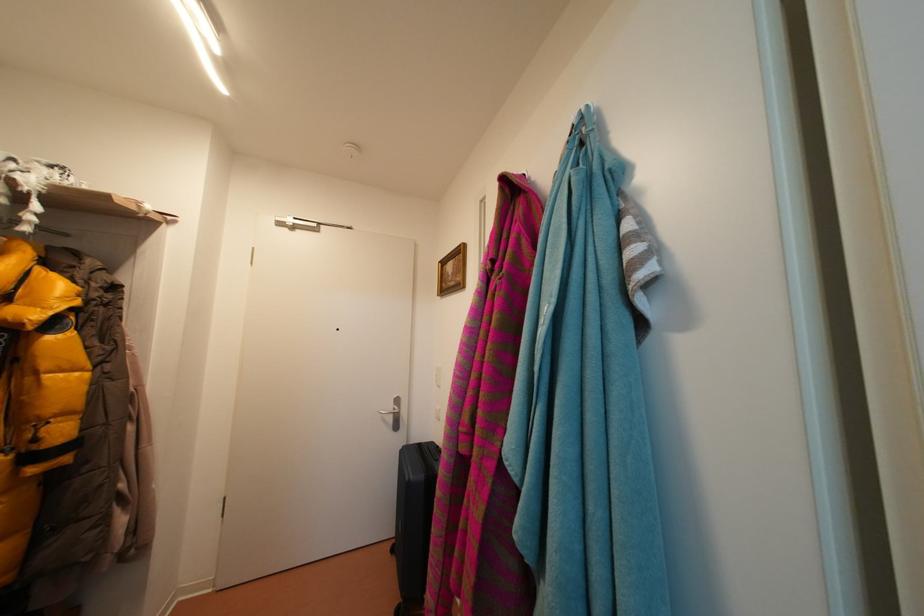
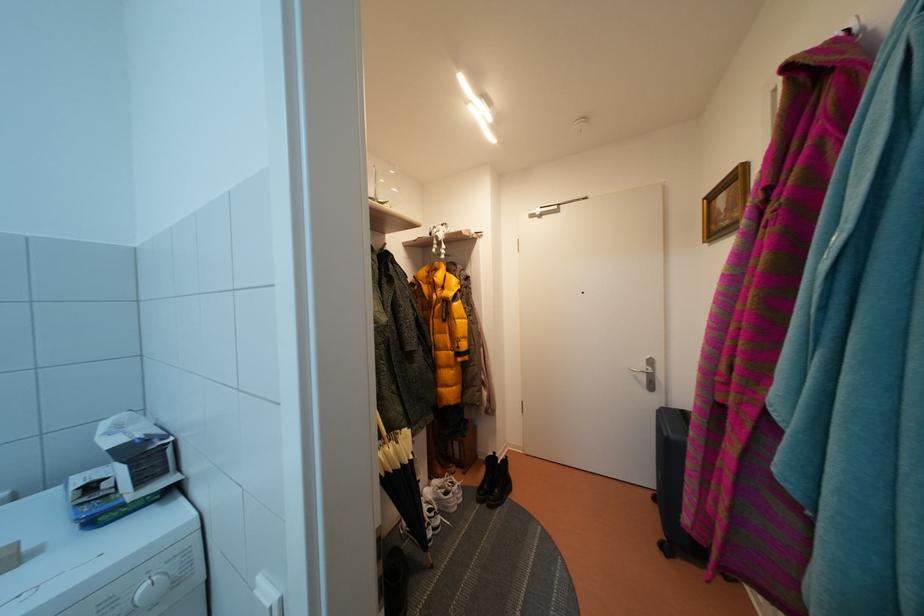
Where in the second image is the point corresponding to (x=398, y=411) from the first image?

(650, 371)